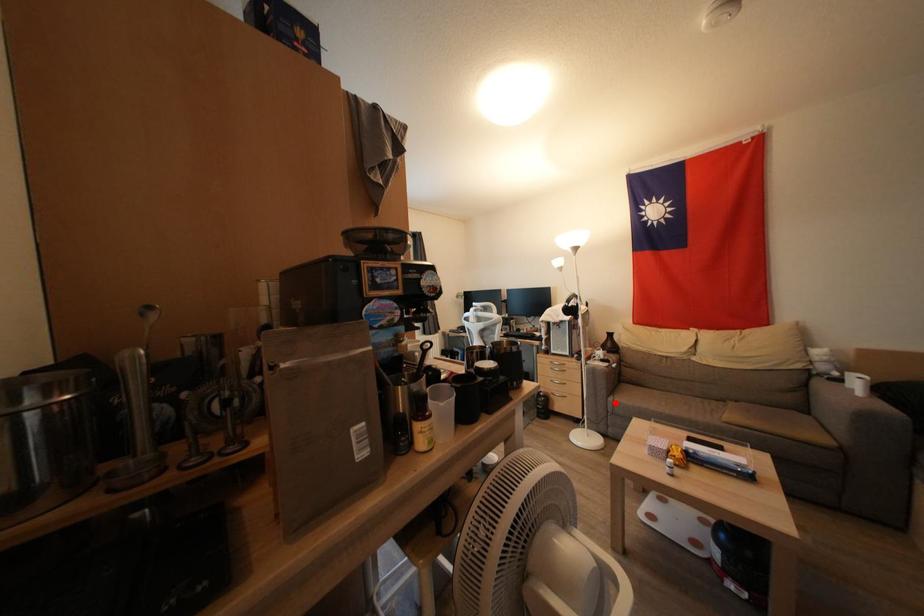
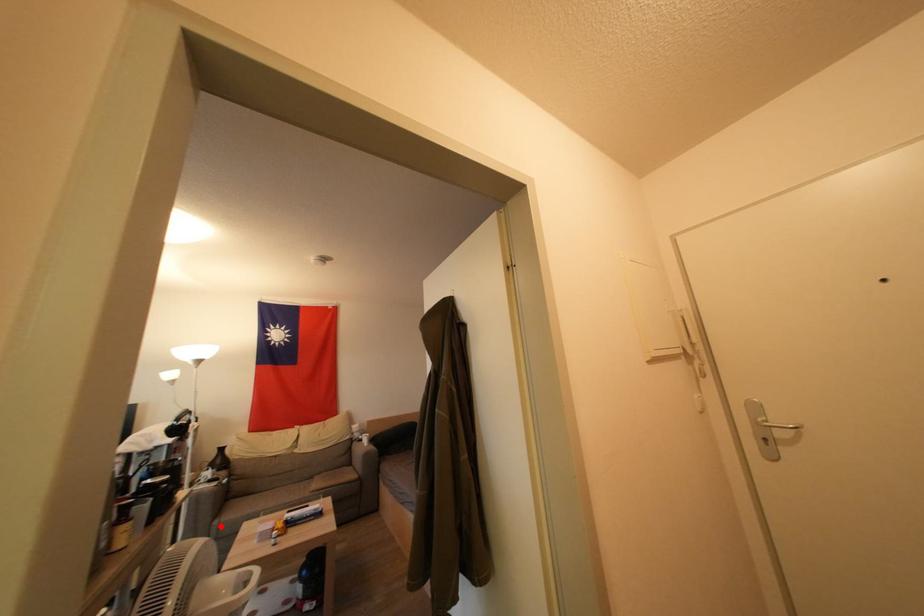
I am providing you with two images of the same scene from different viewpoints. A red point is marked on the first image and another point is marked on the second image. Is the marked point in image1 the same physical position as the marked point in image2?

Yes